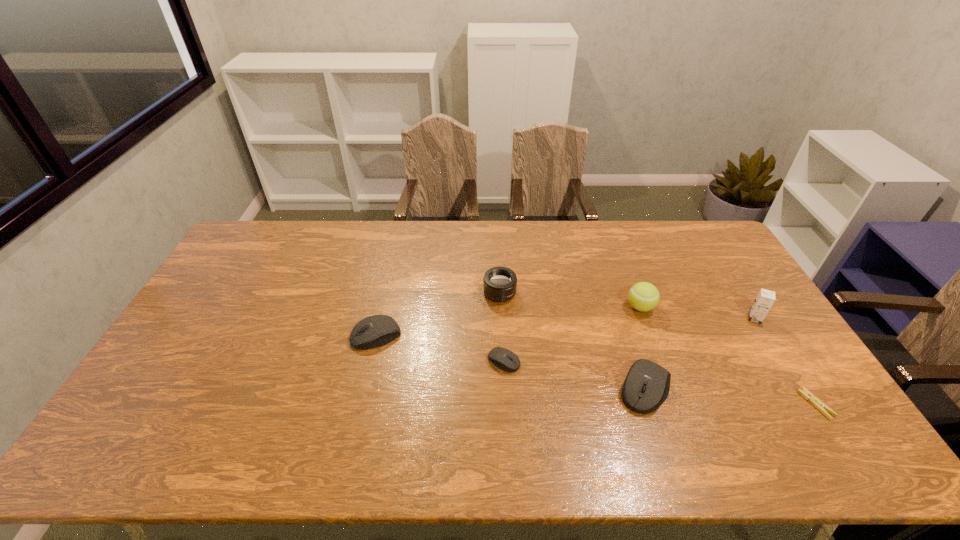
Find the location of a particular element. The width and height of the screenshot is (960, 540). free space between the leftmost object and the clothespin is located at coordinates (596, 370).

Where is `vacant region between the leftmost object and the second tallest object`? vacant region between the leftmost object and the second tallest object is located at coordinates point(508,321).

What are the coordinates of `empty location between the chocolate milk and the rightmost computer equipment` in the screenshot? It's located at (700, 354).

You are a GUI agent. You are given a task and a screenshot of the screen. Output one action in this format:
    pyautogui.click(x=<x>, y=<y>)
    Task: Click on the vacant area between the fifth tallest object and the second computer equipment from right to left
    Image resolution: width=960 pixels, height=540 pixels.
    Given the screenshot: What is the action you would take?
    pyautogui.click(x=440, y=348)

The image size is (960, 540). Find the location of `object that is the second nearest to the tallest object`. object that is the second nearest to the tallest object is located at coordinates (643, 296).

This screenshot has width=960, height=540. Identify the location of object identified as the second closest to the second tallest computer equipment. (508, 361).

Locate an element on the screen. Image resolution: width=960 pixels, height=540 pixels. computer equipment that stands as the second closest to the third tallest object is located at coordinates (374, 331).

Where is `computer equipment that is the third closest to the tallest object`? The image size is (960, 540). computer equipment that is the third closest to the tallest object is located at coordinates (374, 331).

The width and height of the screenshot is (960, 540). Identify the location of vacant area in the image that satisfies the following two spatial constraints: 1. on the side of the fifth shortest object with brand markings and control switches; 2. on the right side of the shortest computer equipment. (503, 361).

I want to click on free space in the image that satisfies the following two spatial constraints: 1. on the side of the tallest object with brand markings and control switches; 2. on the right side of the third tallest object, so click(x=501, y=318).